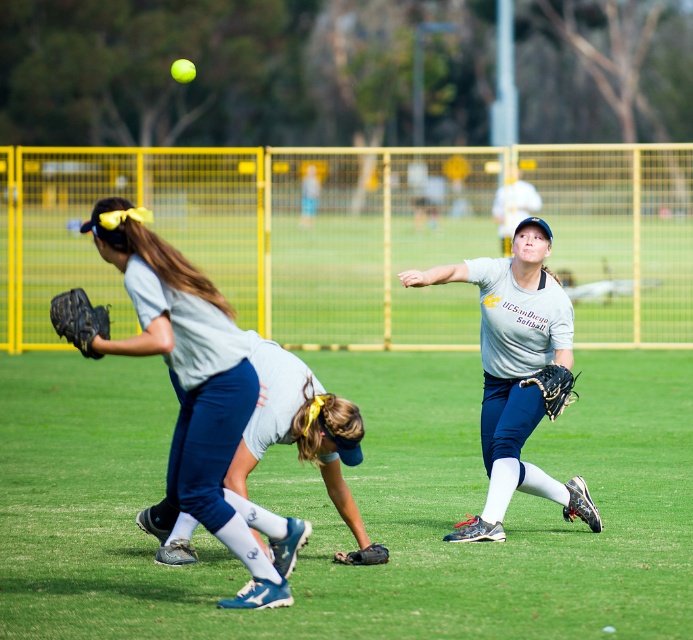
Can you confirm if light gray jersey at center is wider than yellow matte baseball at upper center?

Incorrect, light gray jersey at center's width does not surpass yellow matte baseball at upper center's.

Based on the photo, which is more to the right, light gray jersey at center or yellow matte baseball at upper center?

light gray jersey at center

Identify the location of light gray jersey at center. (195, 392).

Identify the location of light gray jersey at center. The image size is (693, 640). (195, 392).

Is black leather glove at left to the right of black leather baseball glove at center from the viewer's perspective?

In fact, black leather glove at left is to the left of black leather baseball glove at center.

Does point (78, 288) lie in front of point (561, 374)?

That is False.

Locate an element on the screen. The height and width of the screenshot is (640, 693). black leather glove at left is located at coordinates (78, 320).

Based on the photo, between matte gray shirt at center and black leather glove at lower center, which one is positioned lower?

black leather glove at lower center is lower down.

Is matte gray shirt at center behind black leather glove at lower center?

Yes, it is.

Describe the element at coordinates (516, 371) in the screenshot. I see `matte gray shirt at center` at that location.

Where is `matte gray shirt at center`? This screenshot has height=640, width=693. matte gray shirt at center is located at coordinates (516, 371).